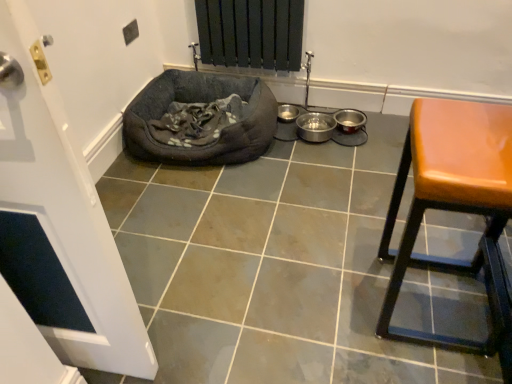
Identify the location of free space below leatherette stool at right (from a real-world perspective). The height and width of the screenshot is (384, 512). (425, 307).